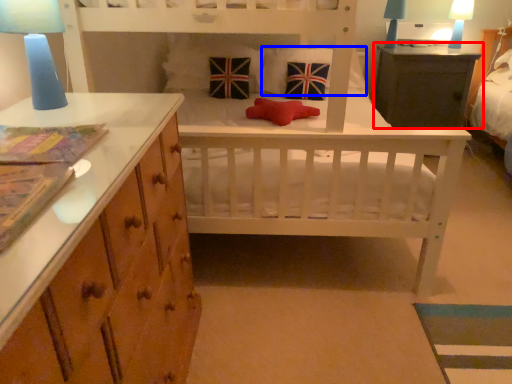
Question: Which object is further to the camera taking this photo, table (highlighted by a red box) or pillow (highlighted by a blue box)?

Choices:
 (A) table
 (B) pillow

Answer: (A)